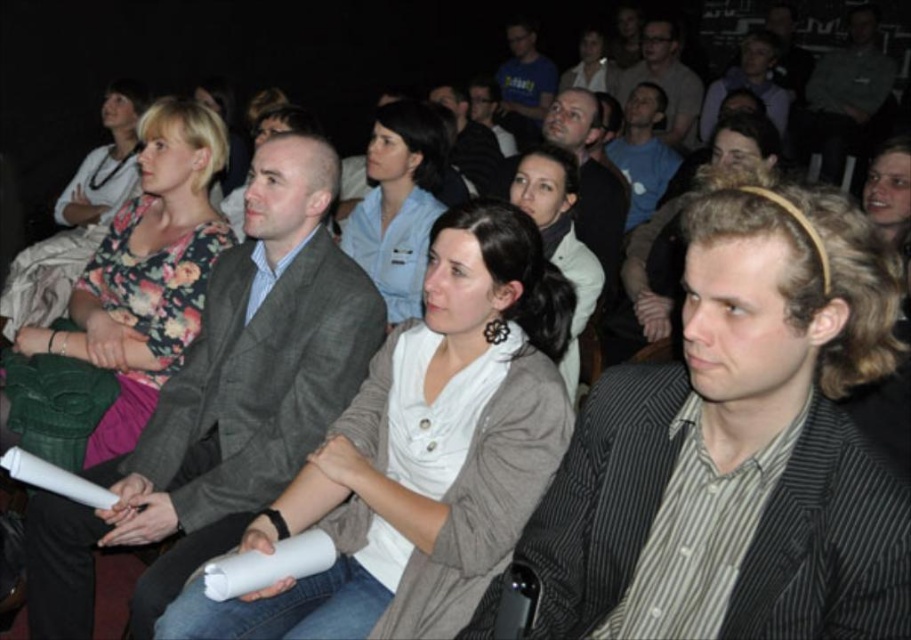
In the auditorium scene, you notice two shirts at the center area. The light blue shirt at center and the white shirt at center. Which one is positioned higher up?

The light blue shirt at center is positioned higher up than the white shirt at center according to the description.

You are sitting at point (183, 179) and want to see the person at point (524, 408). Is there a clear line of sight between you and that person?

Yes, because point (524, 408) is in front of point (183, 179), so there is a clear line of sight between them.